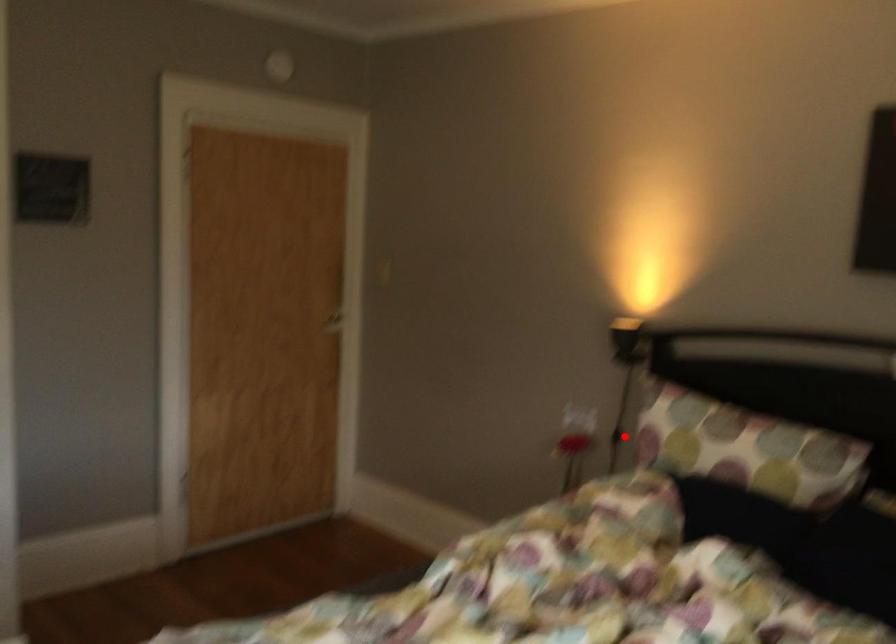
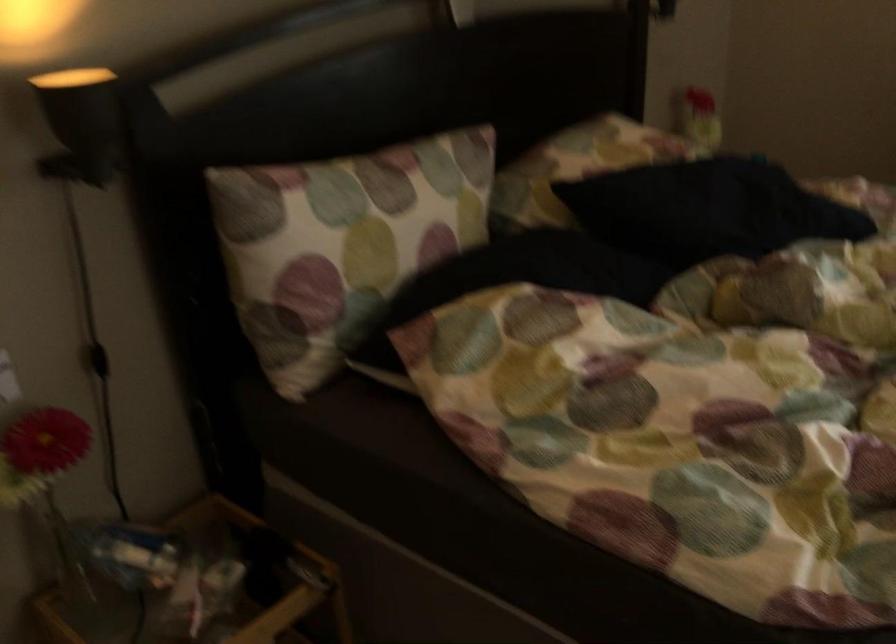
In the second image, find the point that corresponds to the highlighted location in the first image.

(98, 360)